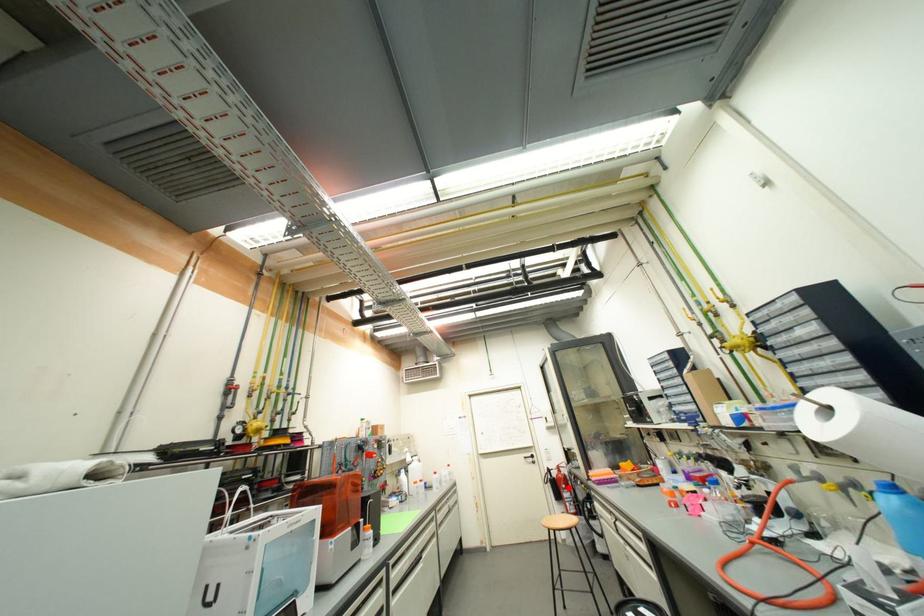
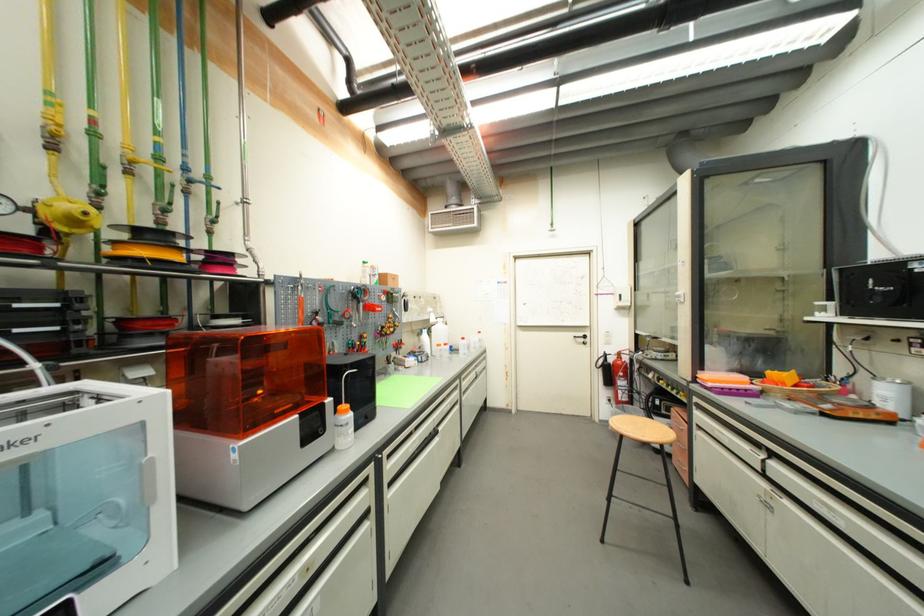
Where in the second image is the point corresponding to the highlighted location from the first image?

(626, 376)